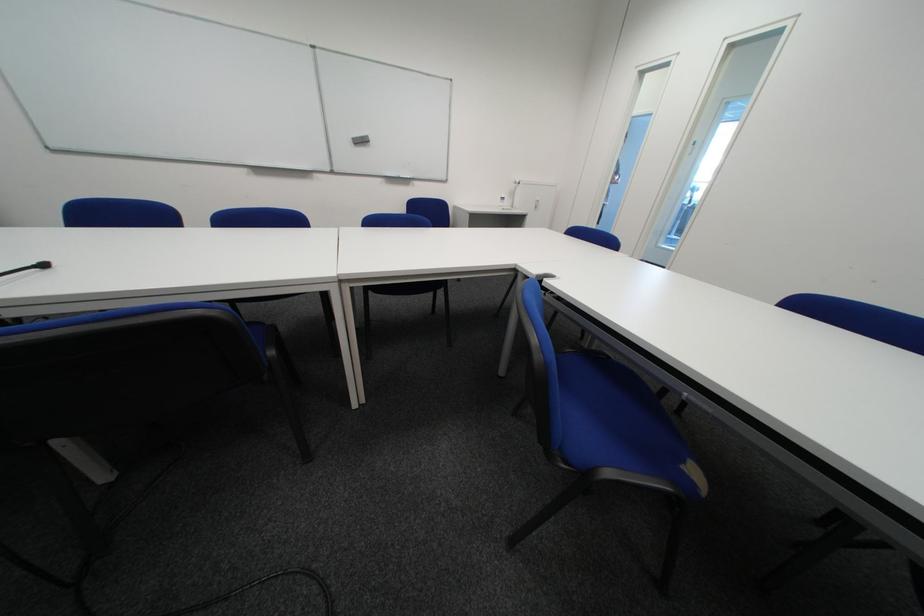
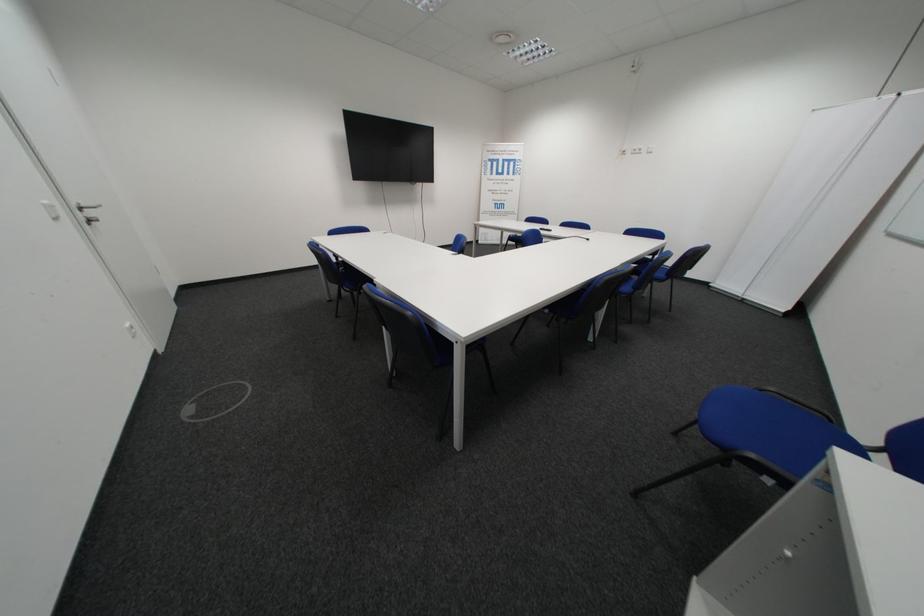
Question: I am providing you with two images of the same scene from different viewpoints. Please identify which objects are invisible in image2.

Choices:
 (A) blue chair sitting surface
 (B) floor outlet cover
 (C) orange toy box
 (D) black table microphone

Answer: (A)